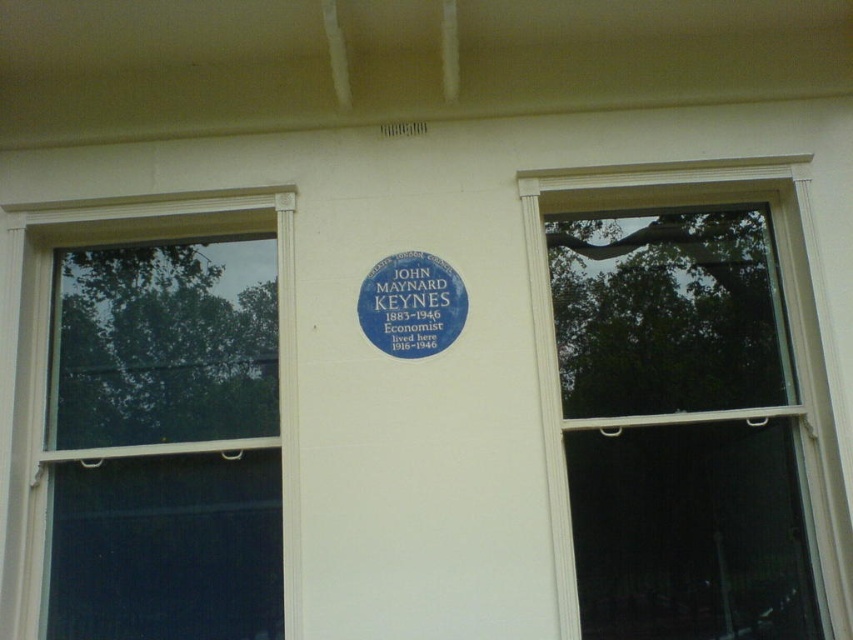
Is the position of white plastic window at left more distant than that of blue metallic plaque at center?

No, white plastic window at left is closer to the viewer.

Can you confirm if white plastic window at left is wider than blue metallic plaque at center?

Yes, white plastic window at left is wider than blue metallic plaque at center.

Which is in front, point (177, 224) or point (376, 298)?

Point (376, 298) is in front.

Image resolution: width=853 pixels, height=640 pixels. Identify the location of white plastic window at left. (44, 349).

Which is above, transparent glass window at upper right or blue metallic plaque at center?

Positioned higher is blue metallic plaque at center.

Who is more forward, (775, 180) or (438, 352)?

Positioned in front is point (438, 352).

Image resolution: width=853 pixels, height=640 pixels. Find the location of `transparent glass window at upper right`. transparent glass window at upper right is located at coordinates (791, 330).

Can you confirm if transparent glass window at upper right is taller than white plastic window at left?

Correct, transparent glass window at upper right is much taller as white plastic window at left.

The width and height of the screenshot is (853, 640). What do you see at coordinates (791, 330) in the screenshot? I see `transparent glass window at upper right` at bounding box center [791, 330].

Which is behind, point (799, 236) or point (19, 509)?

Positioned behind is point (799, 236).

Where is `transparent glass window at upper right`? transparent glass window at upper right is located at coordinates 791,330.